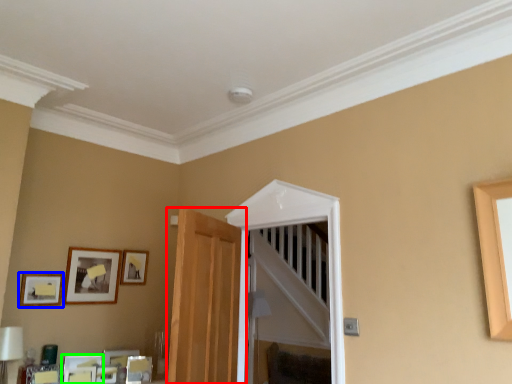
Question: Estimate the real-world distances between objects in this image. Which object is farther from door (highlighted by a red box), picture frame (highlighted by a blue box) or picture frame (highlighted by a green box)?

Choices:
 (A) picture frame
 (B) picture frame

Answer: (A)